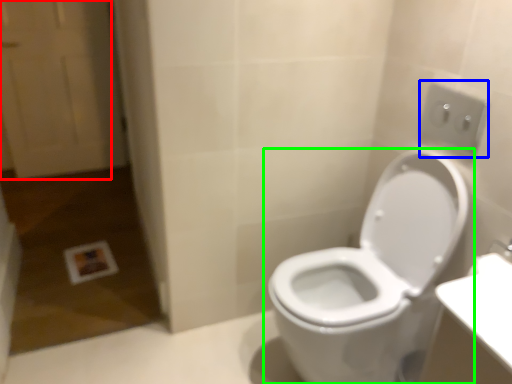
Question: Which is nearer to the screen door (highlighted by a red box)? electric outlet (highlighted by a blue box) or toilet (highlighted by a green box).

Choices:
 (A) electric outlet
 (B) toilet

Answer: (B)